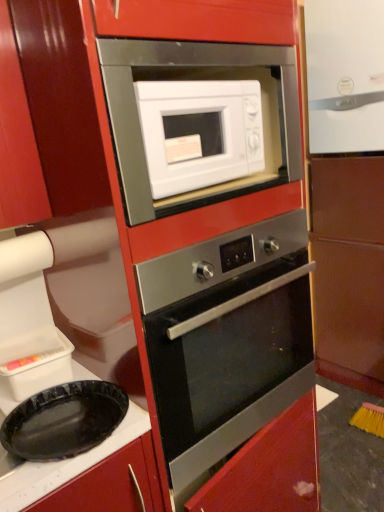
Question: Is stainless steel oven at center wider or thinner than matte brown cabinet at right?

Choices:
 (A) wide
 (B) thin

Answer: (A)

Question: Considering the positions of point (173, 406) and point (319, 199), is point (173, 406) closer or farther from the camera than point (319, 199)?

Choices:
 (A) closer
 (B) farther

Answer: (A)

Question: Based on their relative distances, which object is nearer to the white glossy microwave at center?

Choices:
 (A) black plastic plate at lower left
 (B) white glossy refrigerator at upper right
 (C) stainless steel oven at center
 (D) matte brown cabinet at right

Answer: (C)

Question: Estimate the real-world distances between objects in this image. Which object is closer to the stainless steel oven at center?

Choices:
 (A) black plastic plate at lower left
 (B) white glossy refrigerator at upper right
 (C) matte brown cabinet at right
 (D) white glossy microwave at center

Answer: (A)